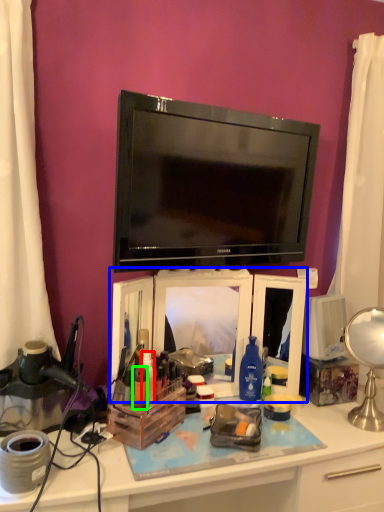
Question: Which object is positioned closest to toiletry (highlighted by a red box)? Select from cabinet (highlighted by a blue box) and toiletry (highlighted by a green box).

Choices:
 (A) cabinet
 (B) toiletry

Answer: (B)